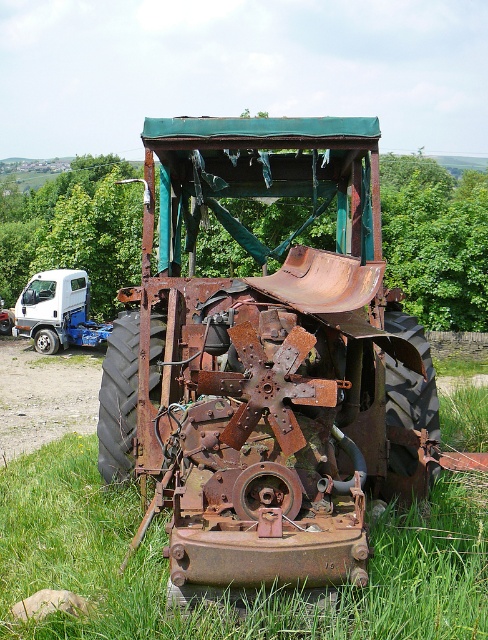
Looking at this image, which is below, rusty metal tractor at center or white matte truck at left?

rusty metal tractor at center is below.

Does point (268, 529) come closer to viewer compared to point (72, 269)?

That is True.

Is point (256, 442) positioned in front of point (48, 308)?

Yes, it is.

The image size is (488, 640). I want to click on rusty metal tractor at center, so pyautogui.click(x=266, y=362).